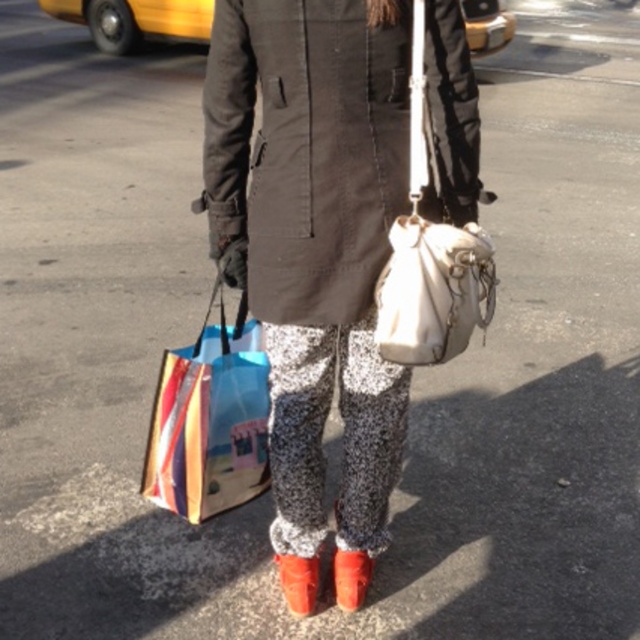
Question: Is matte black coat at center positioned behind speckled fabric pants at center?

Choices:
 (A) yes
 (B) no

Answer: (B)

Question: Which object is the closest to the shiny red boot at lower center?

Choices:
 (A) speckled fabric pants at center
 (B) shiny red high-heeled shoe at lower center

Answer: (B)

Question: Which of these objects is positioned closest to the shiny red high-heeled shoe at lower center?

Choices:
 (A) speckled fabric pants at center
 (B) yellow rubber taxi at upper left

Answer: (A)

Question: Which of the following is the farthest from the observer?

Choices:
 (A) shiny red boot at lower center
 (B) leather/soft white purse at center
 (C) matte black coat at center

Answer: (A)

Question: Is the position of speckled fabric pants at center more distant than that of leather/soft white purse at center?

Choices:
 (A) yes
 (B) no

Answer: (A)

Question: Does colorful paper bag at lower left appear on the left side of shiny red high-heeled shoe at lower center?

Choices:
 (A) yes
 (B) no

Answer: (A)